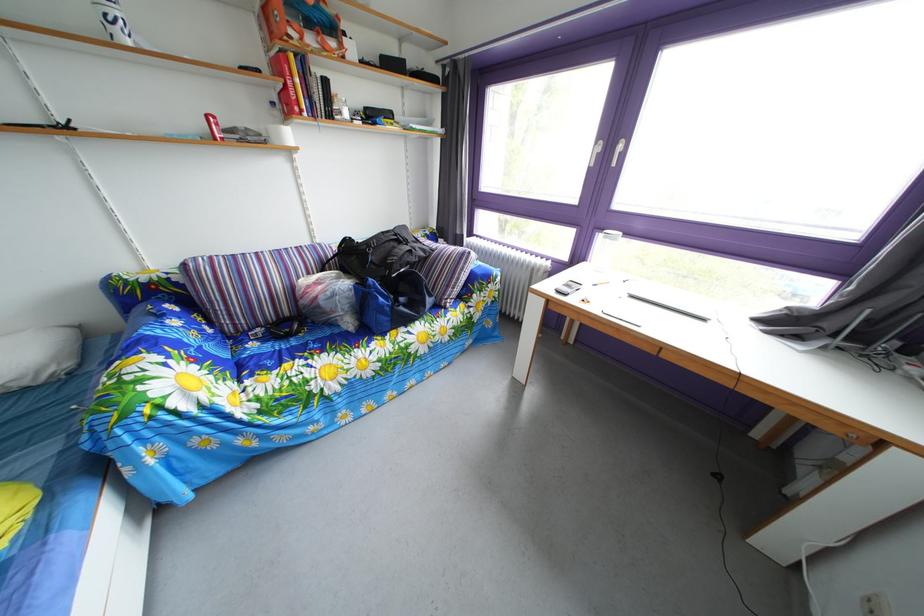
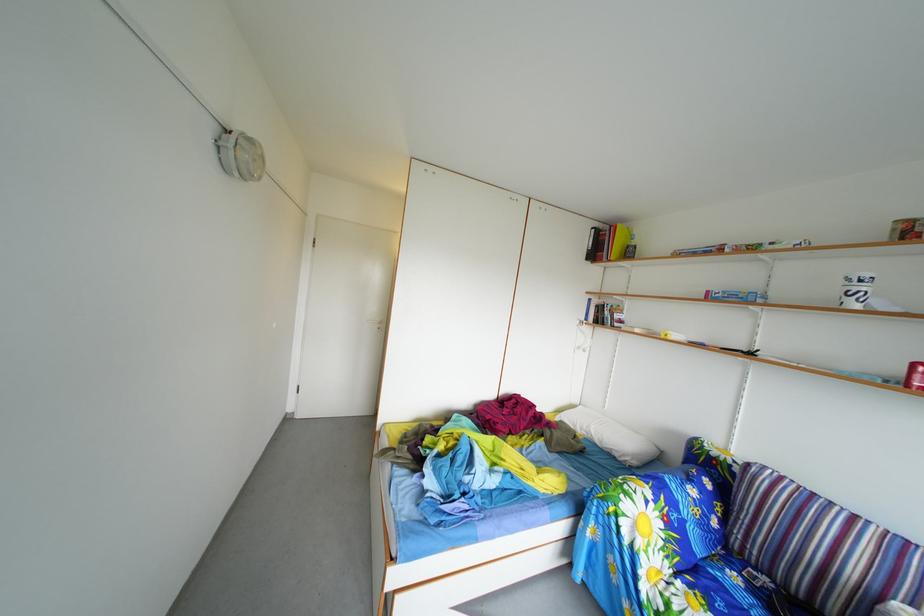
Where in the second image is the point corresponding to [262,353] from the first image?

(746, 585)